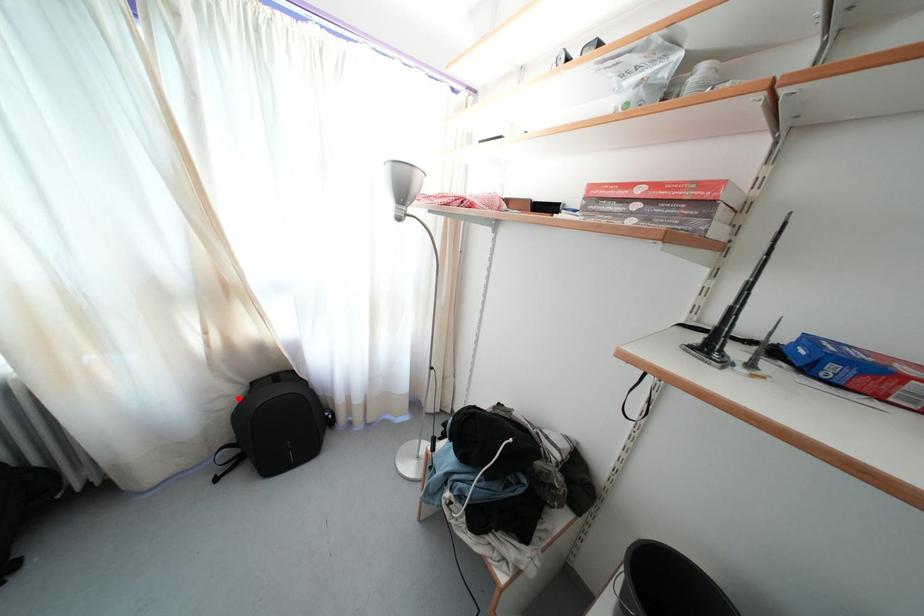
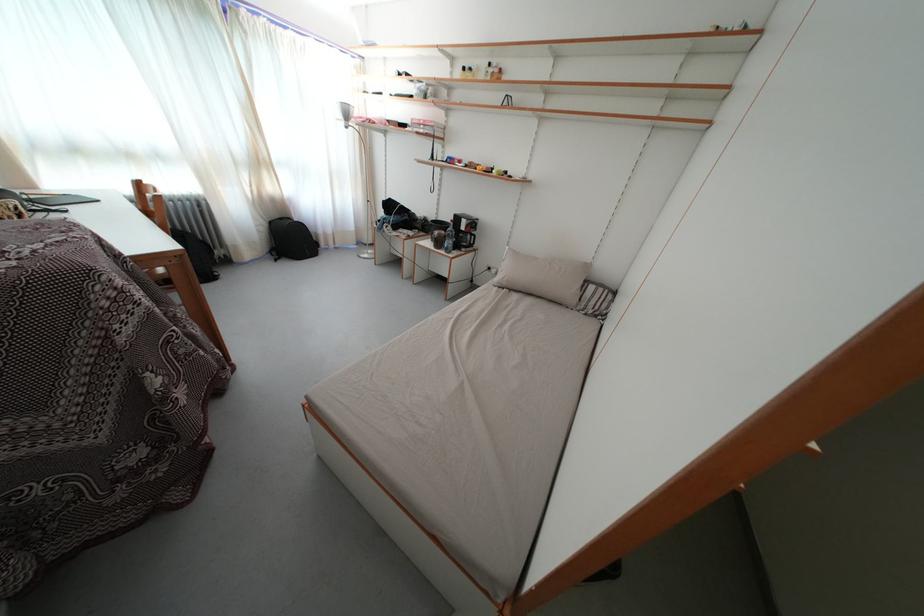
Question: I am providing you with two images of the same scene from different viewpoints. A red point is marked on the first image. At the location where the point appears in image 1, is it still visible in image 2?

Choices:
 (A) Yes
 (B) No

Answer: (A)